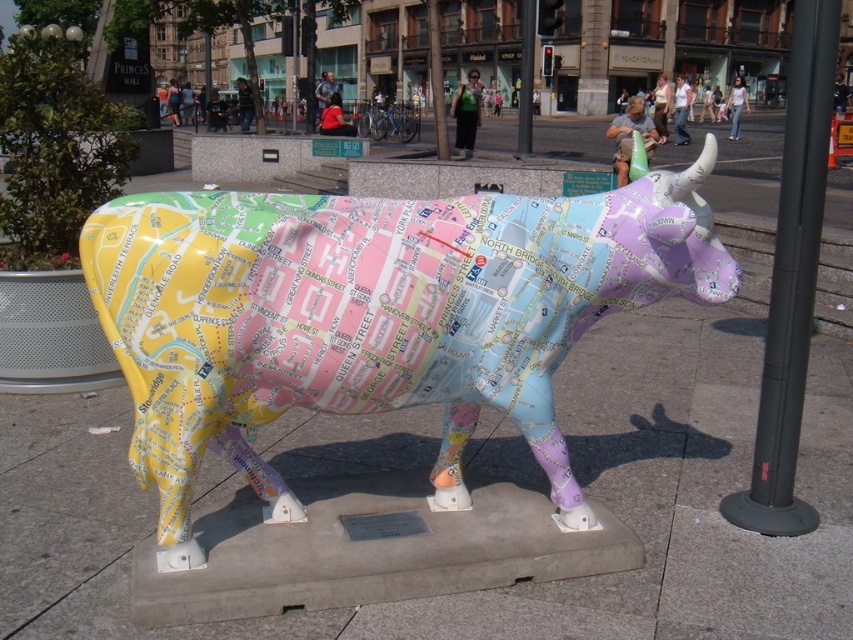
Question: Is map-covered cow at center below black metal pole at right?

Choices:
 (A) yes
 (B) no

Answer: (A)

Question: Is map-covered cow at center to the left of black metal pole at right from the viewer's perspective?

Choices:
 (A) yes
 (B) no

Answer: (A)

Question: Which point is closer to the camera?

Choices:
 (A) (761, 372)
 (B) (154, 476)

Answer: (B)

Question: Which point appears farthest from the camera in this image?

Choices:
 (A) coord(778,252)
 (B) coord(201,241)

Answer: (A)

Question: Does map-covered cow at center have a larger size compared to black metal pole at right?

Choices:
 (A) no
 (B) yes

Answer: (A)